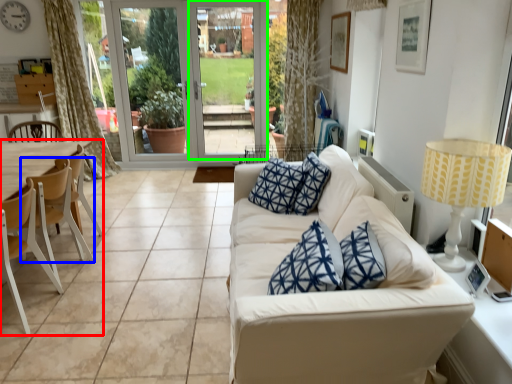
Question: Estimate the real-world distances between objects in this image. Which object is farther from armchair (highlighted by a red box), chair (highlighted by a blue box) or screen door (highlighted by a green box)?

Choices:
 (A) chair
 (B) screen door

Answer: (B)